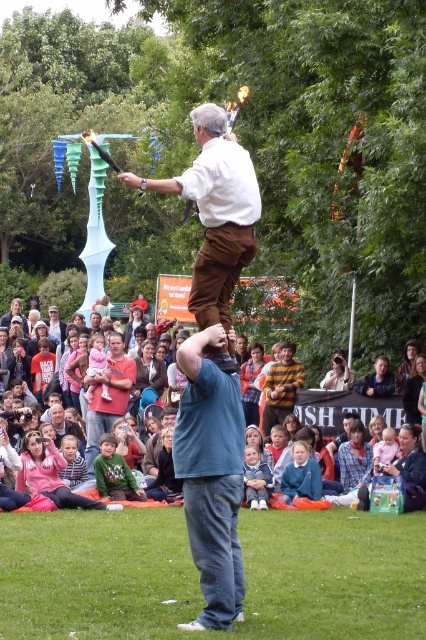
Question: Which point is closer to the camera?

Choices:
 (A) light brown hair at center
 (B) blue cotton t-shirt at center
 (C) blue denim jeans at center
 (D) matte blue fabric at center

Answer: (B)

Question: Does blue cotton t-shirt at center appear over blue denim jeans at center?

Choices:
 (A) yes
 (B) no

Answer: (A)

Question: Which point is farther to the camera?

Choices:
 (A) smooth skin camera at center
 (B) matte white shirt at center
 (C) light brown hair at center
 (D) matte blue fabric at center

Answer: (A)

Question: Which point is farther to the camera?

Choices:
 (A) (385, 378)
 (B) (414, 390)
 (C) (65, 432)

Answer: (C)

Question: Is light brown hair at center smaller than blue denim jeans at center?

Choices:
 (A) no
 (B) yes

Answer: (B)

Question: Is blue cotton t-shirt at center to the right of matte white shirt at center from the viewer's perspective?

Choices:
 (A) yes
 (B) no

Answer: (A)